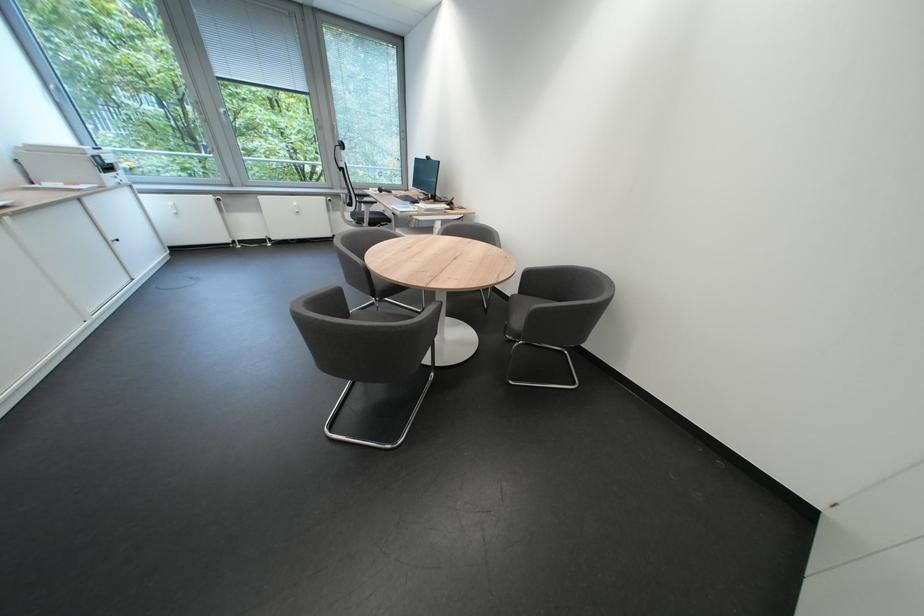
Describe the element at coordinates (114, 238) in the screenshot. I see `a black cabinet handle` at that location.